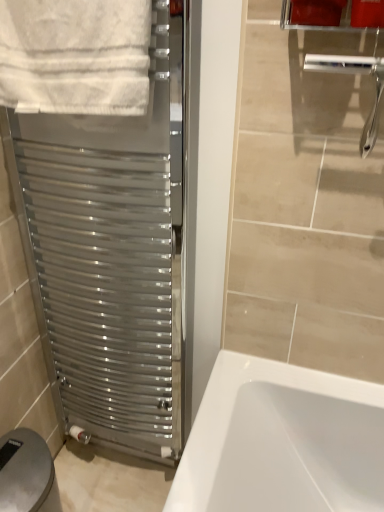
Image resolution: width=384 pixels, height=512 pixels. What are the coordinates of `free space above matte plastic toilet paper holder at lower left (from a real-world perspective)` in the screenshot? It's located at (24, 465).